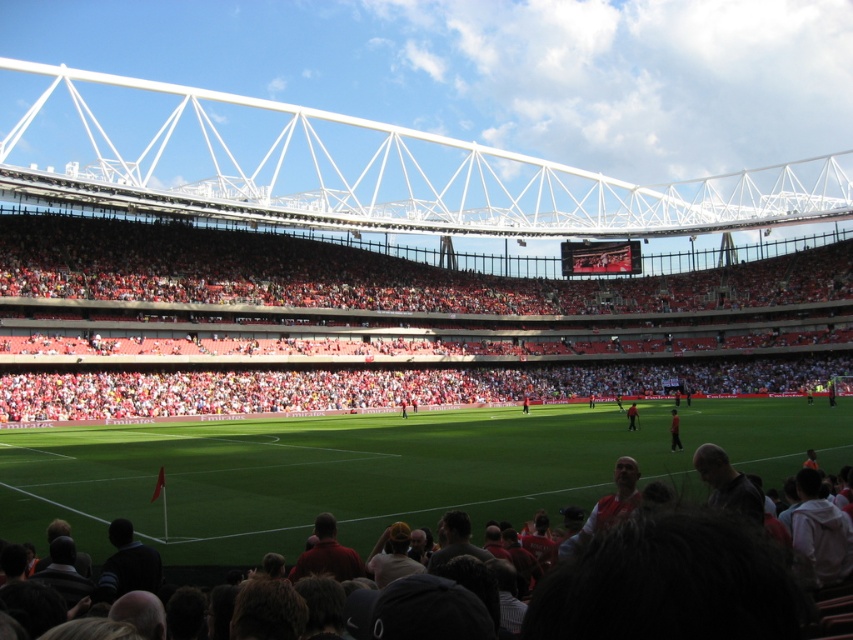
You are a photographer at the stadium and want to capture both the dark red jersey at center and the red shirt at center in a single shot. Given that your camera has a fixed focal length, which object should you frame first to ensure both fit in the photo?

The dark red jersey at center has a larger width than the red shirt at center, so you should frame the dark red jersey at center first to ensure both fit in the photo.

You are standing at the point marked as point (674, 436) in a football stadium. If you want to take a photo of the entire stadium from where you are, will the camera you have, which has a maximum range of 70 meters, be able to capture the entire stadium in one shot?

The distance between point (674, 436) and the camera is 79.15 meters, which exceeds the camera maximum range of 70 meters. Therefore, the camera cannot capture the entire stadium in one shot.

You are sitting in the red plastic seats at center and want to look at the red shirt at center. In which direction should you turn your head to see it?

You should turn your head to the right to see the red shirt at center because the red plastic seats at center are to the left of it.